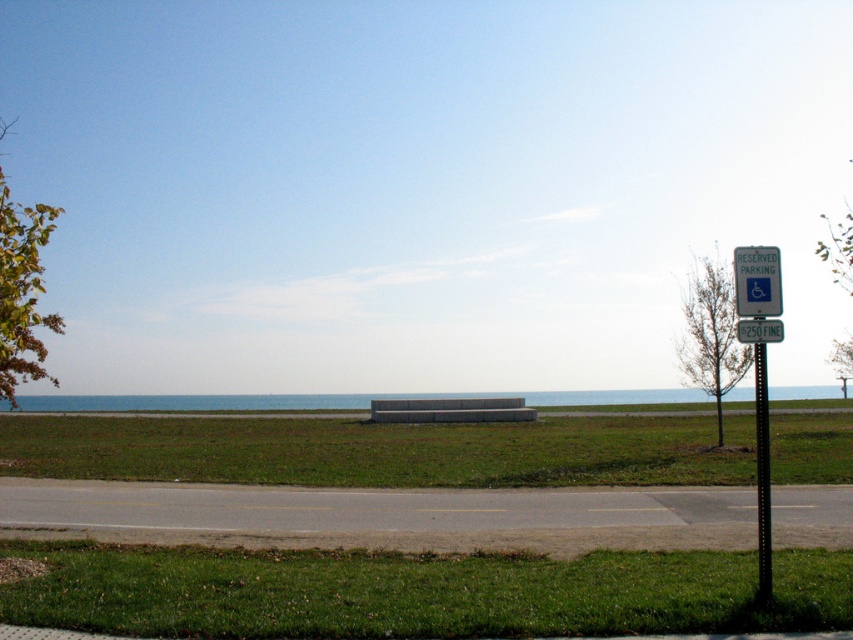
Question: Is green grass at lower center above white plastic sign at right?

Choices:
 (A) yes
 (B) no

Answer: (B)

Question: Which point is closer to the camera?

Choices:
 (A) green leafy tree at left
 (B) white plastic sign at right
 (C) green leafy tree at right

Answer: (B)

Question: Is green leafy tree at left wider than black metal pole at right?

Choices:
 (A) no
 (B) yes

Answer: (B)

Question: Is green grass at center positioned before black metal pole at right?

Choices:
 (A) yes
 (B) no

Answer: (B)

Question: Based on their relative distances, which object is farther from the green grass at center?

Choices:
 (A) white plastic sign at right
 (B) green leafy tree at right
 (C) green leafy tree at left
 (D) green grass at lower center

Answer: (D)

Question: Considering the real-world distances, which object is closest to the green grass at lower center?

Choices:
 (A) black metal pole at right
 (B) green leafy tree at left

Answer: (A)